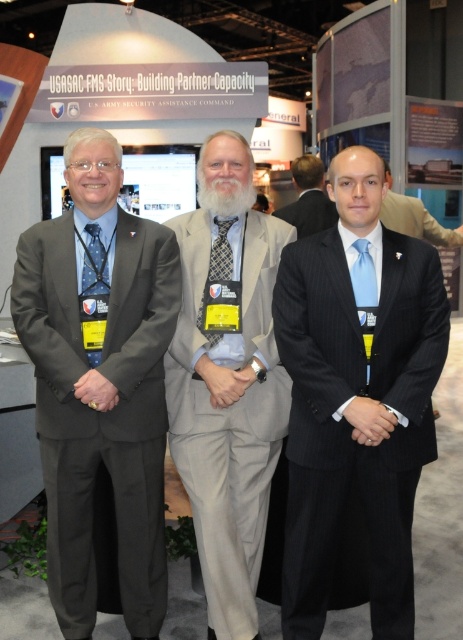
Question: Which object is positioned closest to the blue dotted tie at left?

Choices:
 (A) gray wool suit at center
 (B) blue dotted fabric tie at left
 (C) blue silk tie at center

Answer: (B)

Question: Does blue dotted tie at left appear under patterned silk tie at center?

Choices:
 (A) yes
 (B) no

Answer: (B)

Question: Observing the image, what is the correct spatial positioning of light blue silk tie at center in reference to patterned silk tie at center?

Choices:
 (A) left
 (B) right

Answer: (B)

Question: Which object is the closest to the gray wool suit at center?

Choices:
 (A) patterned silk tie at center
 (B) matte gray suit at left
 (C) gray suit at center

Answer: (A)

Question: Is gray wool suit at center to the right of light blue silk tie at center from the viewer's perspective?

Choices:
 (A) yes
 (B) no

Answer: (B)

Question: Which point is closer to the camera?

Choices:
 (A) (88, 257)
 (B) (85, 332)
 (C) (432, 228)

Answer: (B)